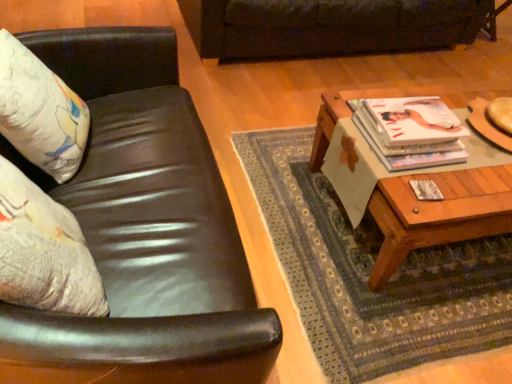
At what (x,y) coordinates should I click in order to perform the action: click on vacant point above white glossy magazine at upper right (from a real-world perspective). Please return your answer as a coordinate pair (x, y). Looking at the image, I should click on (414, 121).